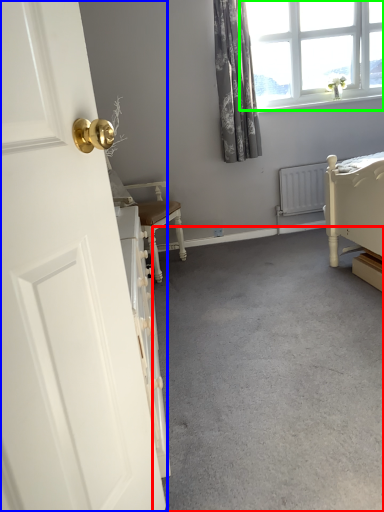
Question: Which object is the farthest from concrete (highlighted by a red box)? Choose among these: door (highlighted by a blue box) or window (highlighted by a green box).

Choices:
 (A) door
 (B) window

Answer: (B)